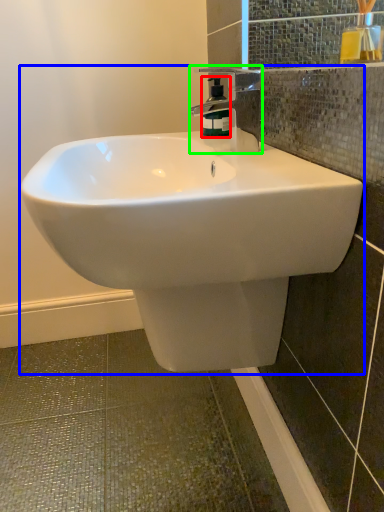
Question: Based on their relative distances, which object is farther from soap dispenser (highlighted by a red box)? Choose from sink (highlighted by a blue box) and tap (highlighted by a green box).

Choices:
 (A) sink
 (B) tap

Answer: (A)